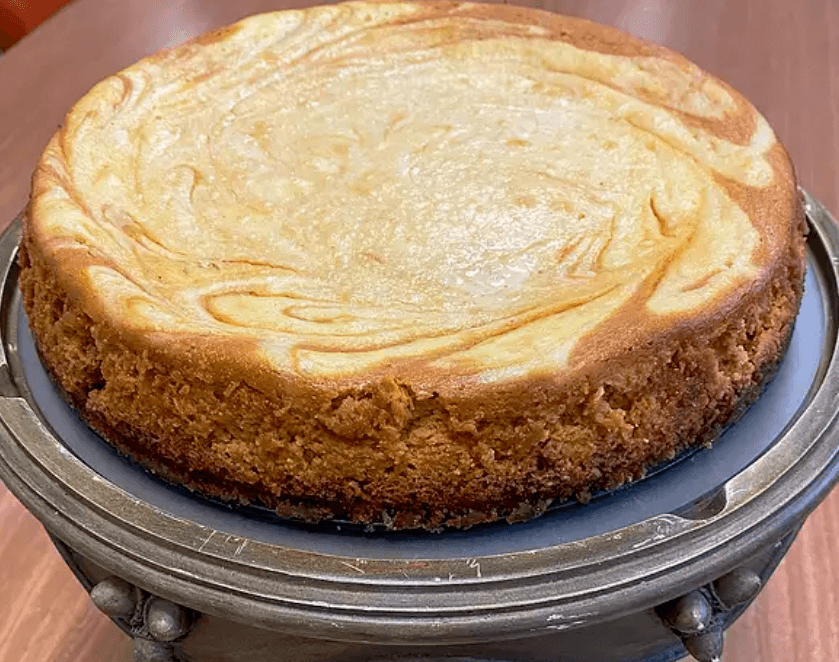
Identify the location of wood grain in table. (800, 590).